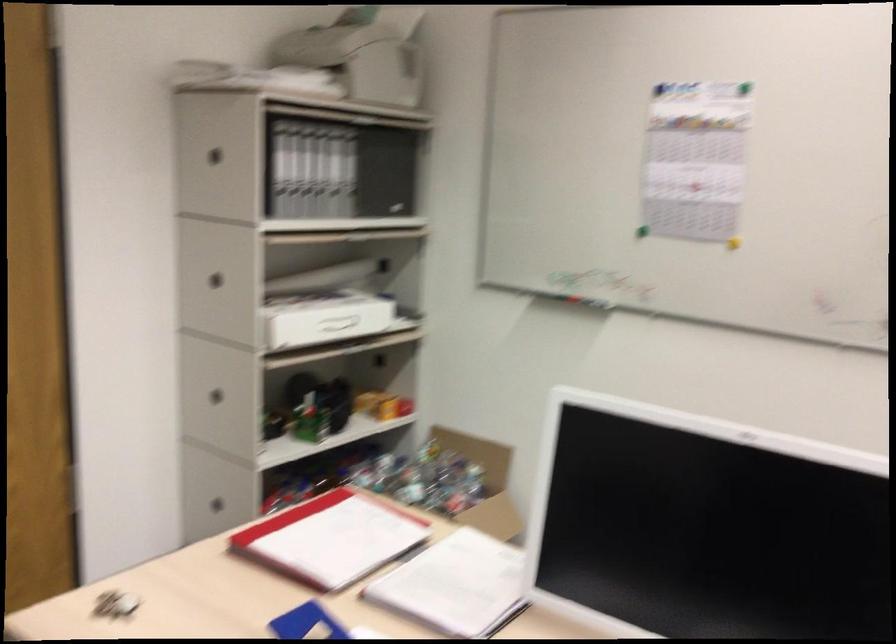
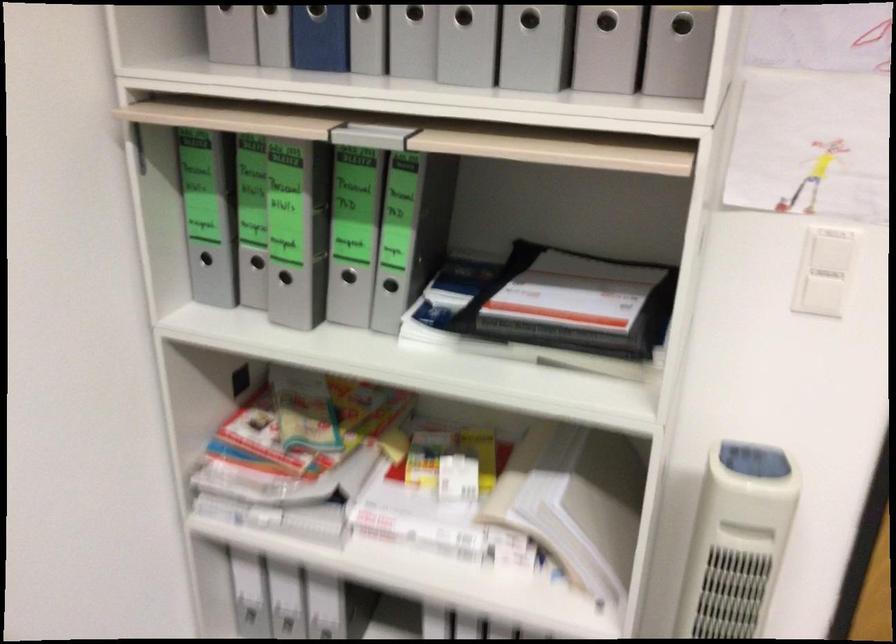
The first image is from the beginning of the video and the second image is from the end. How did the camera likely rotate when shooting the video?

The camera rotated toward left-down.